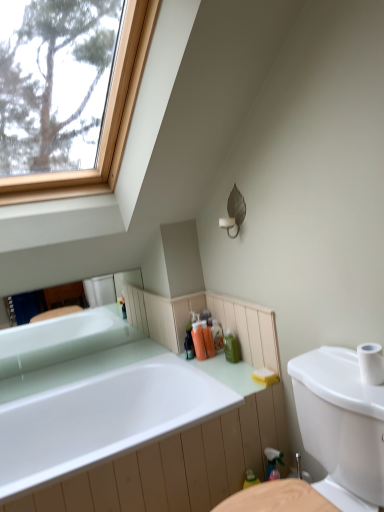
Identify the location of vacant space in front of translucent plastic bottles at center, the 4th toiletry positioned from the right. (209, 372).